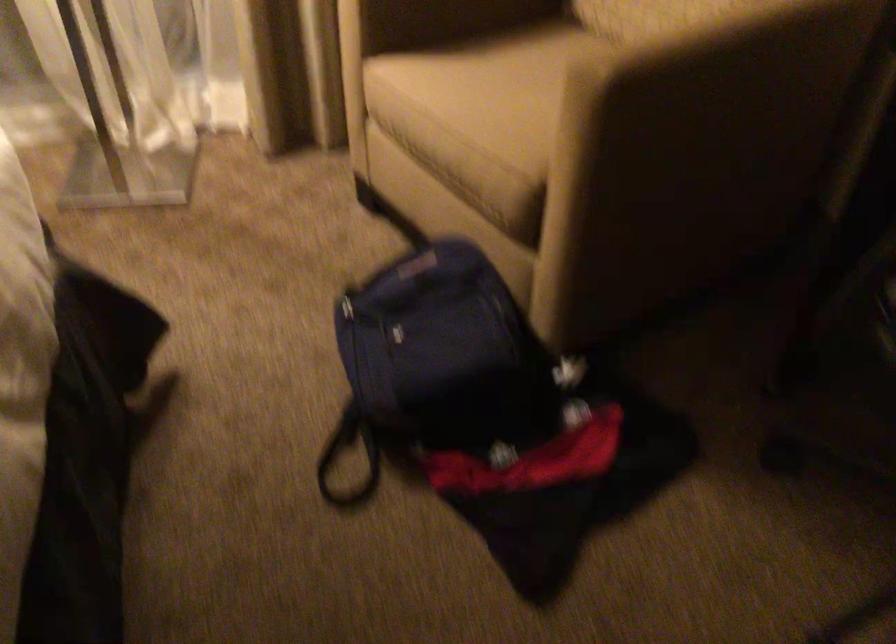
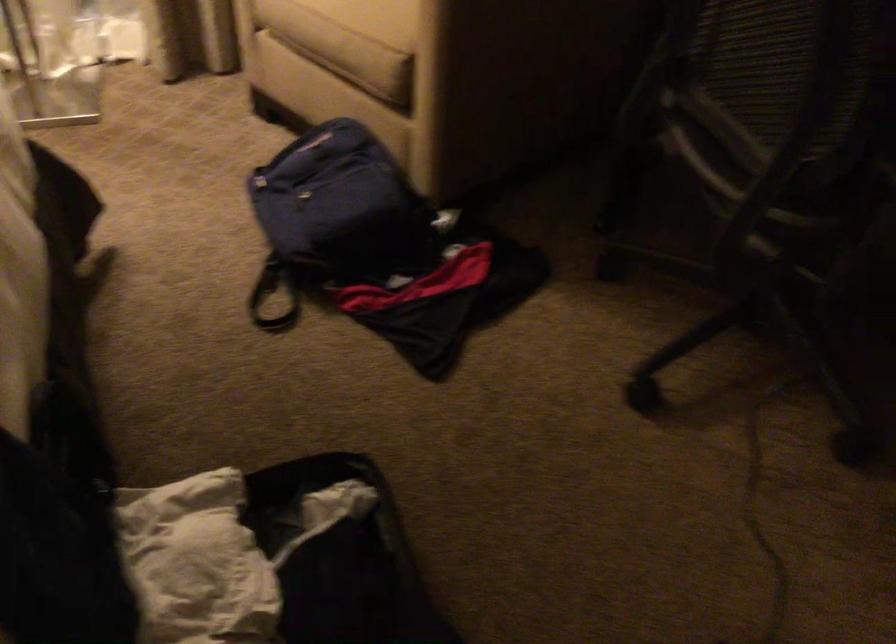
Locate, in the second image, the point that corresponds to the point at 467,167 in the first image.

(347, 53)